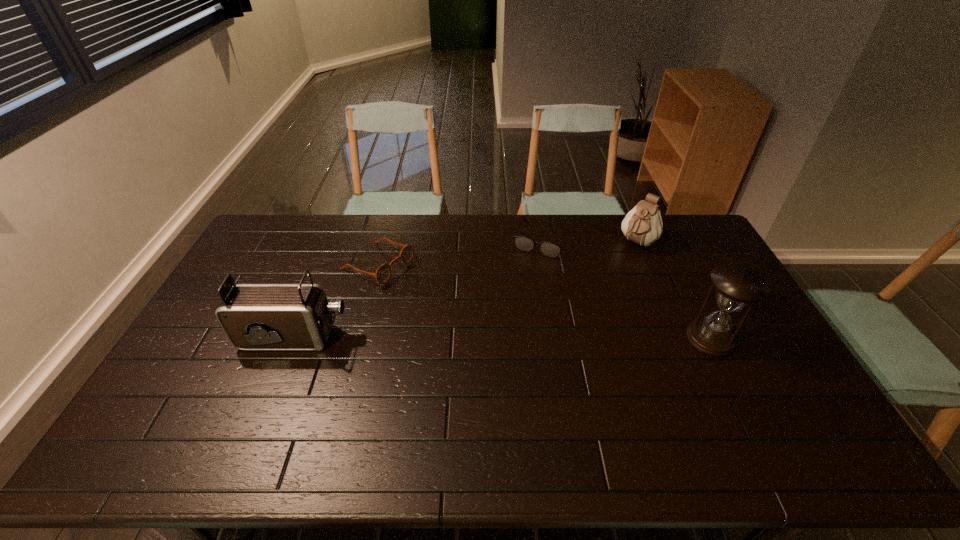
Identify the location of vacant space at the near edge. This screenshot has height=540, width=960. (669, 406).

Find the location of `blank area at the left edge`. blank area at the left edge is located at coordinates (230, 346).

Where is `free spot at the far left corner of the desktop`? The width and height of the screenshot is (960, 540). free spot at the far left corner of the desktop is located at coordinates (270, 226).

Locate an element on the screen. free location at the near left corner of the desktop is located at coordinates (181, 391).

Where is `free space between the third object from left to right and the camcorder`? free space between the third object from left to right and the camcorder is located at coordinates (419, 289).

Where is `vacant area that lies between the camcorder and the pouch`? vacant area that lies between the camcorder and the pouch is located at coordinates (466, 290).

The width and height of the screenshot is (960, 540). What are the coordinates of `free point between the camcorder and the right spectacles` in the screenshot? It's located at (419, 289).

Identify the location of vacant point located between the camcorder and the right spectacles. This screenshot has width=960, height=540. (419, 289).

The width and height of the screenshot is (960, 540). I want to click on vacant region between the pouch and the camcorder, so click(466, 290).

Find the location of a particular element. The width and height of the screenshot is (960, 540). vacant space that's between the third object from right to left and the hourglass is located at coordinates (627, 289).